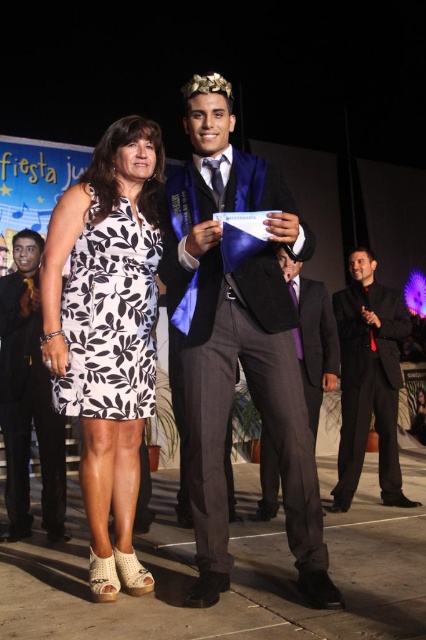
You are organizing a photo album and need to decide which item takes up more space when folded. Based on the image, which object is larger in size between the matte blue graduation gown at center and the black printed fabric dress at center?

The matte blue graduation gown at center is larger in size than the black printed fabric dress at center, so it would take up more space when folded.

You are a photographer positioned at the back of the room. You need to capture a photo of both the matte black suit at center and the black satin suit at right without moving the subjects. Can you fit both into your camera frame if your camera has a maximum horizontal field of view of 6 feet?

The distance between the matte black suit at center and the black satin suit at right is 7.20 feet, which exceeds the camera frame of 6 feet. Therefore, you cannot fit both into the frame without moving the subjects.